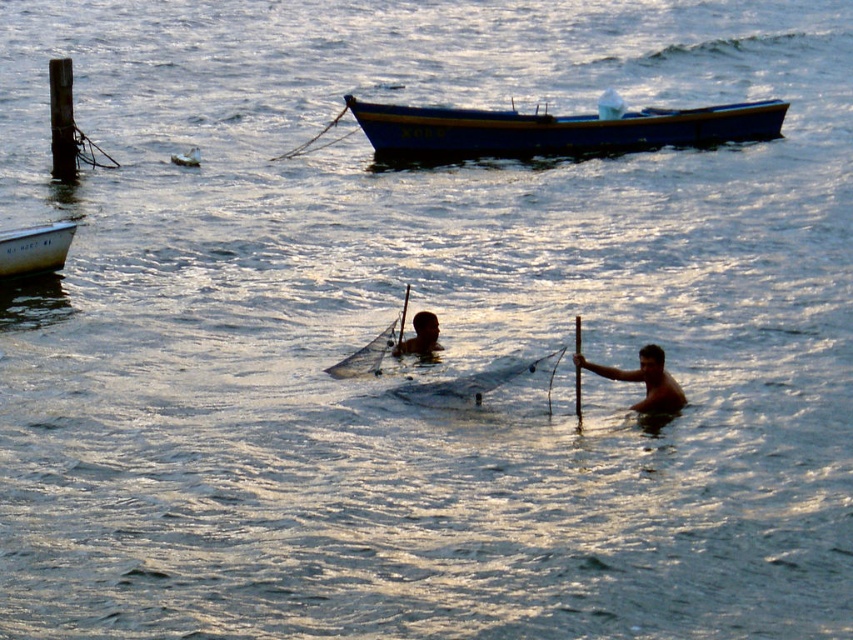
How far apart are blue polished wood boat at upper center and white plastic boat at left?

10.91 meters

Which of these two, blue polished wood boat at upper center or white plastic boat at left, stands shorter?

Standing shorter between the two is blue polished wood boat at upper center.

Locate an element on the screen. The image size is (853, 640). blue polished wood boat at upper center is located at coordinates (552, 131).

Identify the location of blue polished wood boat at upper center. (552, 131).

Which is behind, point (416, 344) or point (187, 156)?

Point (187, 156)

From the picture: Is smooth skin man at center behind white plastic bottle at upper left?

No, smooth skin man at center is closer to the viewer.

The height and width of the screenshot is (640, 853). I want to click on smooth skin man at center, so click(421, 337).

Does point (44, 269) come behind point (425, 323)?

Yes, it is behind point (425, 323).

Who is shorter, white plastic boat at left or smooth skin man at center?

smooth skin man at center is shorter.

Between point (32, 259) and point (409, 337), which one is positioned in front?

Point (409, 337) is in front.

What are the coordinates of `white plastic boat at left` in the screenshot? It's located at (35, 248).